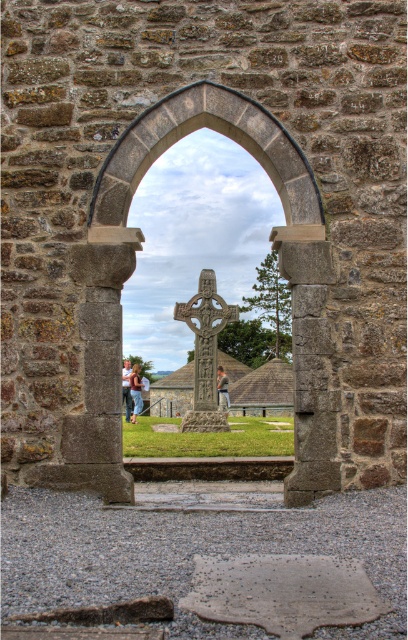
Between carved stone cross at center and light brown leather jacket at center, which one appears on the right side from the viewer's perspective?

From the viewer's perspective, light brown leather jacket at center appears more on the right side.

Which is behind, point (195, 408) or point (223, 378)?

The point (223, 378) is more distant.

This screenshot has width=408, height=640. What do you see at coordinates (204, 353) in the screenshot? I see `carved stone cross at center` at bounding box center [204, 353].

At what (x,y) coordinates should I click in order to perform the action: click on carved stone cross at center. Please return your answer as a coordinate pair (x, y). The image size is (408, 640). Looking at the image, I should click on (204, 353).

Between brown leather jacket at center and blurred fabric person at center, which one is positioned higher?

blurred fabric person at center is above.

At what (x,y) coordinates should I click in order to perform the action: click on brown leather jacket at center. Please return your answer as a coordinate pair (x, y). This screenshot has width=408, height=640. Looking at the image, I should click on (135, 390).

Does point (308, 490) come farther from viewer compared to point (133, 396)?

That is False.

Is point (330, 260) positioned after point (132, 384)?

No, it is in front of (132, 384).

Where is `gray stone pillar at center`? The image size is (408, 640). gray stone pillar at center is located at coordinates (310, 362).